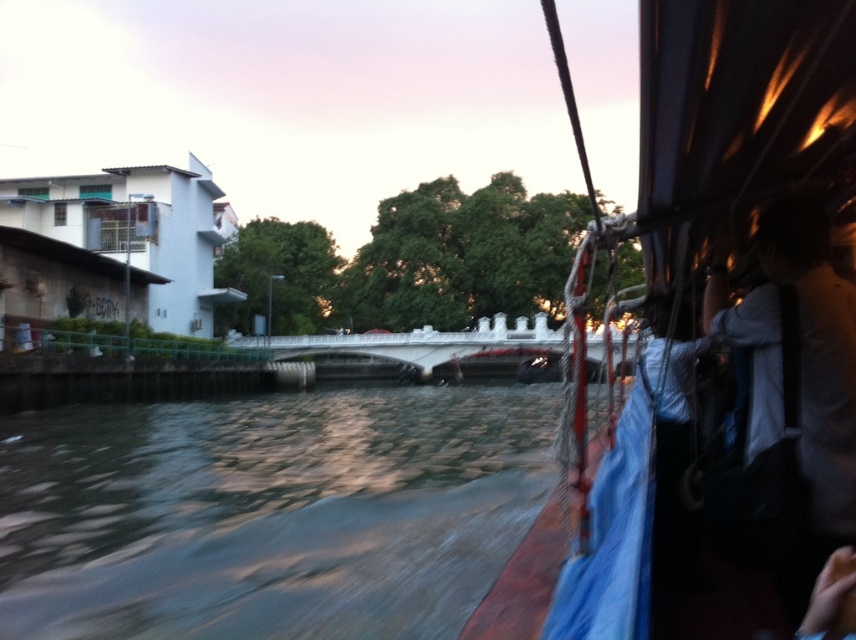
You are a passenger on the boat and want to look at the green stone river at center and the blue tarpaulin boat at right. Which object is located to the left of the other?

The green stone river at center is positioned on the left side of blue tarpaulin boat at right, so the green stone river at center is to the left of the blue tarpaulin boat at right.

You are a passenger on the boat and want to know if the green stone river at center can fit the white fabric bag at right entirely within its area. Based on their sizes, what do you think?

The green stone river at center is bigger than the white fabric bag at right, so yes, the white fabric bag at right can fit entirely within the area of the green stone river at center.

You are standing on the deck of the boat and need to place a large cooler. The cooler is wider than the white fabric bag at right. Can you safely place it on the blue tarpaulin boat at right without exceeding its width?

The blue tarpaulin boat at right might be wider than the white fabric bag at right. Since the cooler is wider than the white fabric bag at right, it might fit on the blue tarpaulin boat at right if its width is sufficient. However, the exact dimensions are uncertain, so caution is advised.